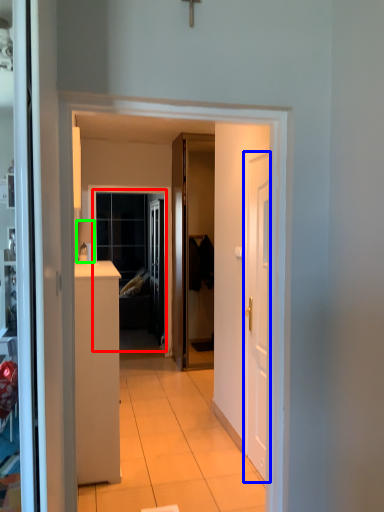
Question: Which object is the farthest from window (highlighted by a red box)? Choose among these: door (highlighted by a blue box) or lamp (highlighted by a green box).

Choices:
 (A) door
 (B) lamp

Answer: (A)